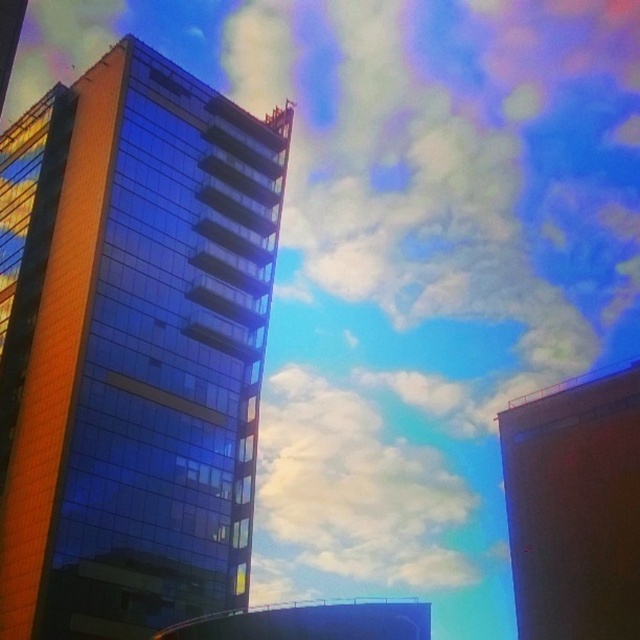
You are standing in the city and see the shiny glass building at left and the white fluffy cloud at upper center. Which object is positioned to the left of the other?

The shiny glass building at left is positioned to the left of the white fluffy cloud at upper center.

You are standing on the rooftop of the shiny glass building at left and want to launch a drone to take a photo of the white fluffy cloud at upper center. The drone has a maximum flight distance of 300 feet. Can the drone reach the cloud?

The shiny glass building at left and white fluffy cloud at upper center are 337.35 feet apart from each other. Since the drone can only fly up to 300 feet, it cannot reach the cloud.

You are standing in front of the modern building and want to determine the relative positions of two points marked in the scene. Which point, point (92,177) or point (445,515), is closer to you?

Point (92,177) is closer to the viewer than point (445,515).